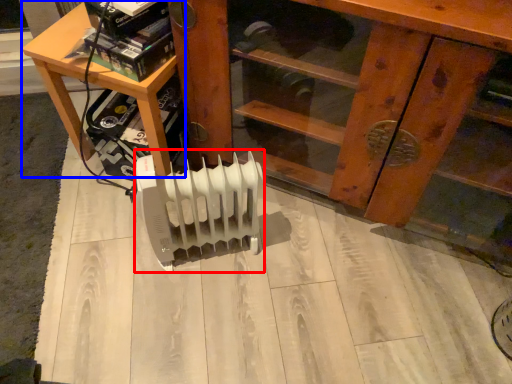
Question: Which of the following is the closest to the observer, heater (highlighted by a red box) or table (highlighted by a blue box)?

Choices:
 (A) heater
 (B) table

Answer: (A)